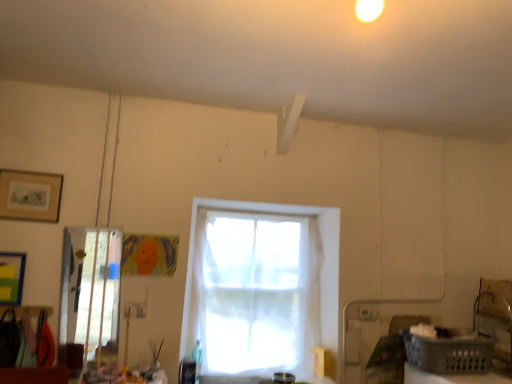
Find the location of `clear glass door at left`. clear glass door at left is located at coordinates (89, 287).

In order to face clear glass door at left, should I rotate leftwards or rightwards?

Turn left approximately 21.236 degrees to face it.

This screenshot has height=384, width=512. In order to click on white sheer curtain at center in this screenshot , I will do `click(320, 268)`.

This screenshot has width=512, height=384. Identify the location of matte black picture frame at upper left. (30, 195).

At what (x,y) coordinates should I click in order to perform the action: click on basket below the white sheer curtain at center (from a real-world perspective). Please return your answer as a coordinate pair (x, y). The height and width of the screenshot is (384, 512). Looking at the image, I should click on (449, 354).

Is white sheer curtain at center completely or partially outside of gray plastic basket at lower right?

Indeed, white sheer curtain at center is completely outside gray plastic basket at lower right.

From a real-world perspective, is white sheer curtain at center on gray plastic basket at lower right?

Yes, from a real-world perspective, white sheer curtain at center is over gray plastic basket at lower right

In terms of size, does white sheer curtain at center appear bigger or smaller than gray plastic basket at lower right?

white sheer curtain at center is bigger than gray plastic basket at lower right.

Considering the positions of point (96, 301) and point (452, 349), is point (96, 301) closer or farther from the camera than point (452, 349)?

Clearly, point (96, 301) is more distant from the camera than point (452, 349).

Between clear glass door at left and gray plastic basket at lower right, which one has smaller width?

clear glass door at left is thinner.

Which is more to the right, clear glass door at left or gray plastic basket at lower right?

From the viewer's perspective, gray plastic basket at lower right appears more on the right side.

Is clear glass door at left oriented towards gray plastic basket at lower right?

No, clear glass door at left is not aimed at gray plastic basket at lower right.

Is matte black picture frame at upper left closer to the viewer compared to white sheer curtain at center?

Yes, matte black picture frame at upper left is closer to the viewer.

From a real-world perspective, between matte black picture frame at upper left and white sheer curtain at center, who is vertically higher?

matte black picture frame at upper left, from a real-world perspective.

From the image's perspective, is matte black picture frame at upper left located above white sheer curtain at center?

Indeed, from the image's perspective, matte black picture frame at upper left is shown above white sheer curtain at center.

Is clear glass door at left at the back of white sheer curtain at center?

No, white sheer curtain at center is not facing the opposite direction of clear glass door at left.

Considering their positions, is white sheer curtain at center located in front of or behind clear glass door at left?

Clearly, white sheer curtain at center is behind clear glass door at left.

Which of these two, white sheer curtain at center or clear glass door at left, is smaller?

Smaller between the two is clear glass door at left.

Identify the location of glass door that appears above the gray plastic basket at lower right (from the image's perspective). The height and width of the screenshot is (384, 512). (89, 287).

Which object is thinner, gray plastic basket at lower right or clear glass door at left?

With smaller width is clear glass door at left.

From a real-world perspective, which object stands above the other?

clear glass door at left.

Between gray plastic basket at lower right and clear glass door at left, which one appears on the left side from the viewer's perspective?

Positioned to the left is clear glass door at left.

Is matte black picture frame at upper left far away from gray plastic basket at lower right?

Absolutely, matte black picture frame at upper left is distant from gray plastic basket at lower right.

Does matte black picture frame at upper left lie in front of gray plastic basket at lower right?

No, it is not.

What's the angular difference between matte black picture frame at upper left and gray plastic basket at lower right's facing directions?

They differ by 90 degrees in their facing directions.

From the image's perspective, would you say matte black picture frame at upper left is shown under gray plastic basket at lower right?

Incorrect, from the image's perspective, matte black picture frame at upper left is higher than gray plastic basket at lower right.

How many degrees apart are the facing directions of matte black picture frame at upper left and clear glass door at left?

The angle between the facing direction of matte black picture frame at upper left and the facing direction of clear glass door at left is 0.000802 degrees.

In the scene shown: From the image's perspective, is matte black picture frame at upper left below clear glass door at left?

No.

There is a clear glass door at left. Identify the location of picture frame above it (from a real-world perspective). (30, 195).

Is matte black picture frame at upper left next to clear glass door at left and touching it?

No.

You are a GUI agent. You are given a task and a screenshot of the screen. Output one action in this format:
    pyautogui.click(x=<x>, y=<y>)
    Task: Click on the basket to the right of white sheer curtain at center
    The width and height of the screenshot is (512, 384).
    Given the screenshot: What is the action you would take?
    pyautogui.click(x=449, y=354)

At what (x,y) coordinates should I click in order to perform the action: click on glass door above the gray plastic basket at lower right (from a real-world perspective). Please return your answer as a coordinate pair (x, y). This screenshot has height=384, width=512. Looking at the image, I should click on (89, 287).

Estimate the real-world distances between objects in this image. Which object is closer to clear glass door at left, white sheer curtain at center or matte black picture frame at upper left?

Based on the image, matte black picture frame at upper left appears to be nearer to clear glass door at left.

Which object lies further to the anchor point white sheer curtain at center, clear glass door at left or gray plastic basket at lower right?

clear glass door at left.

Considering their positions, is white sheer curtain at center positioned further to matte black picture frame at upper left than clear glass door at left?

Based on the image, white sheer curtain at center appears to be further to matte black picture frame at upper left.

When comparing their distances from white sheer curtain at center, does matte black picture frame at upper left or clear glass door at left seem closer?

The object closer to white sheer curtain at center is clear glass door at left.

Based on their spatial positions, is gray plastic basket at lower right or white sheer curtain at center closer to clear glass door at left?

The object closer to clear glass door at left is white sheer curtain at center.

Based on their spatial positions, is gray plastic basket at lower right or matte black picture frame at upper left further from clear glass door at left?

gray plastic basket at lower right is positioned further to the anchor clear glass door at left.

Which object lies further to the anchor point white sheer curtain at center, clear glass door at left or matte black picture frame at upper left?

matte black picture frame at upper left is positioned further to the anchor white sheer curtain at center.

Considering their positions, is clear glass door at left positioned further to gray plastic basket at lower right than matte black picture frame at upper left?

matte black picture frame at upper left is positioned further to the anchor gray plastic basket at lower right.

I want to click on window between matte black picture frame at upper left and gray plastic basket at lower right from left to right, so click(x=320, y=268).

Where is `window situated between clear glass door at left and gray plastic basket at lower right from left to right`? This screenshot has width=512, height=384. window situated between clear glass door at left and gray plastic basket at lower right from left to right is located at coordinates (320, 268).

At what (x,y) coordinates should I click in order to perform the action: click on glass door situated between matte black picture frame at upper left and gray plastic basket at lower right from left to right. Please return your answer as a coordinate pair (x, y). The width and height of the screenshot is (512, 384). Looking at the image, I should click on (89, 287).

Where is `glass door between matte black picture frame at upper left and white sheer curtain at center`? glass door between matte black picture frame at upper left and white sheer curtain at center is located at coordinates (89, 287).